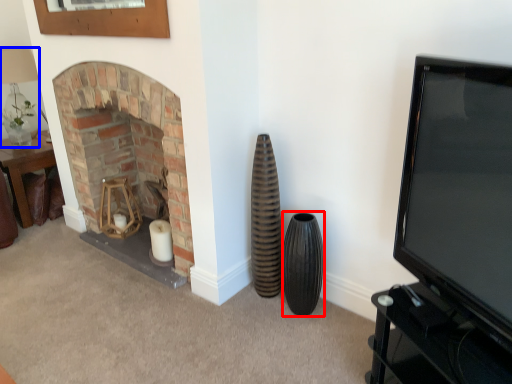
Question: Which point is further to the camera, vase (highlighted by a red box) or lamp (highlighted by a blue box)?

Choices:
 (A) vase
 (B) lamp

Answer: (B)